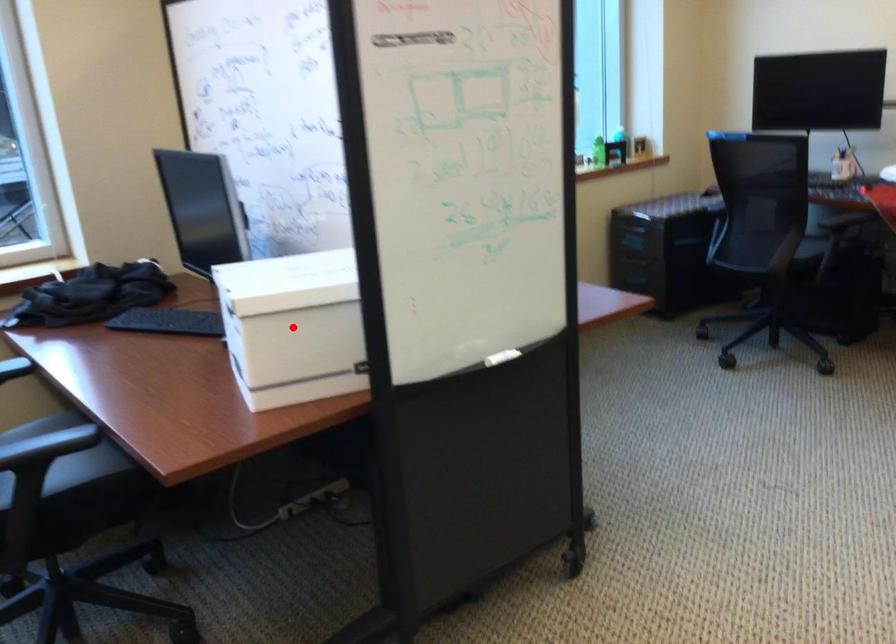
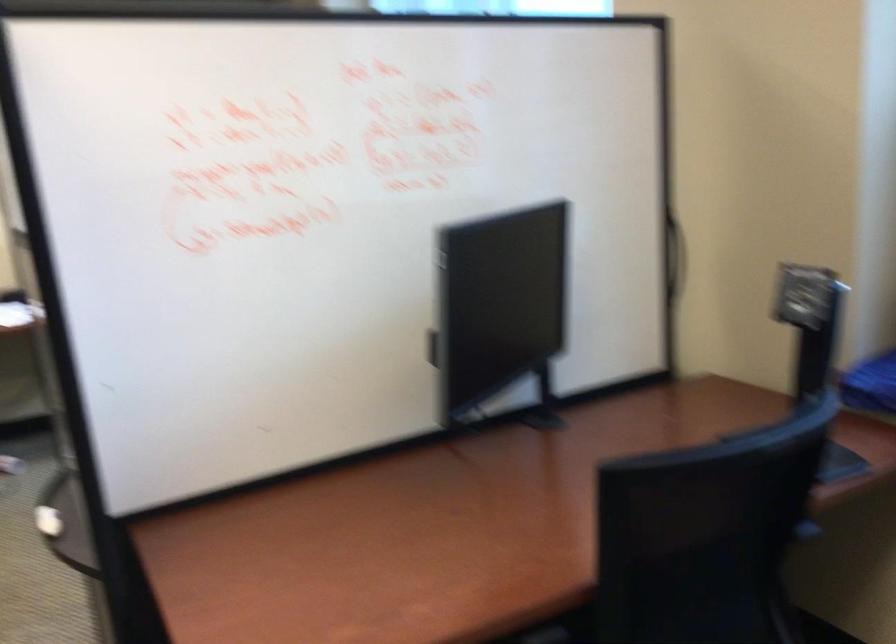
Question: I am providing you with two images of the same scene from different viewpoints. A red point is marked on the first image. Is the red point's position out of view in image 2?

Choices:
 (A) Yes
 (B) No

Answer: (A)